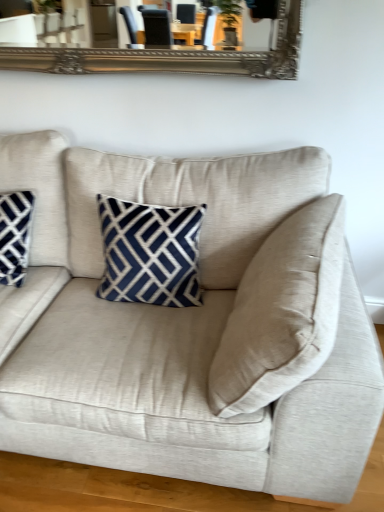
Question: Relative to matte blue and white geometric pillow at left, is beige fabric couch at center in front or behind?

Choices:
 (A) front
 (B) behind

Answer: (A)

Question: Considering the positions of beige fabric couch at center and matte blue and white geometric pillow at left in the image, is beige fabric couch at center bigger or smaller than matte blue and white geometric pillow at left?

Choices:
 (A) small
 (B) big

Answer: (B)

Question: Considering the positions of beige fabric couch at center and matte blue and white geometric pillow at left in the image, is beige fabric couch at center wider or thinner than matte blue and white geometric pillow at left?

Choices:
 (A) wide
 (B) thin

Answer: (A)

Question: From the image's perspective, is matte blue and white geometric pillow at left positioned above or below beige fabric couch at center?

Choices:
 (A) below
 (B) above

Answer: (B)

Question: Is matte blue and white geometric pillow at left inside or outside of beige fabric couch at center?

Choices:
 (A) outside
 (B) inside

Answer: (B)

Question: From a real-world perspective, relative to beige fabric couch at center, is matte blue and white geometric pillow at left vertically above or below?

Choices:
 (A) above
 (B) below

Answer: (A)

Question: Is matte blue and white geometric pillow at left wider or thinner than beige fabric couch at center?

Choices:
 (A) wide
 (B) thin

Answer: (B)